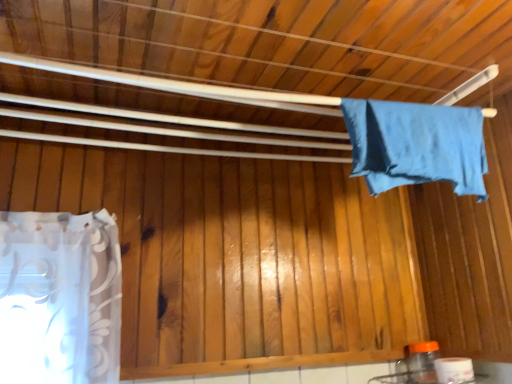
Question: Considering the positions of blue fabric at upper right and white glossy toilet paper at lower right in the image, is blue fabric at upper right bigger or smaller than white glossy toilet paper at lower right?

Choices:
 (A) big
 (B) small

Answer: (A)

Question: Considering the positions of blue fabric at upper right and white glossy toilet paper at lower right in the image, is blue fabric at upper right taller or shorter than white glossy toilet paper at lower right?

Choices:
 (A) short
 (B) tall

Answer: (B)

Question: Is blue fabric at upper right in front of or behind white glossy toilet paper at lower right in the image?

Choices:
 (A) front
 (B) behind

Answer: (A)

Question: Based on their sizes in the image, would you say white glossy toilet paper at lower right is bigger or smaller than blue fabric at upper right?

Choices:
 (A) small
 (B) big

Answer: (A)

Question: Is white glossy toilet paper at lower right in front of or behind blue fabric at upper right in the image?

Choices:
 (A) front
 (B) behind

Answer: (B)

Question: Does point (448, 370) appear closer or farther from the camera than point (428, 160)?

Choices:
 (A) closer
 (B) farther

Answer: (B)

Question: Is white glossy toilet paper at lower right situated inside blue fabric at upper right or outside?

Choices:
 (A) inside
 (B) outside

Answer: (B)